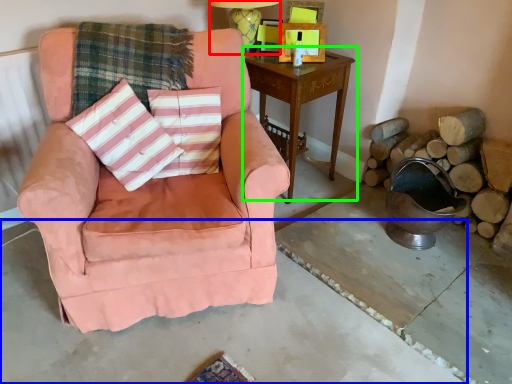
Question: Based on their relative distances, which object is nearer to table lamp (highlighted by a red box)? Choose from concrete (highlighted by a blue box) and nightstand (highlighted by a green box).

Choices:
 (A) concrete
 (B) nightstand

Answer: (B)